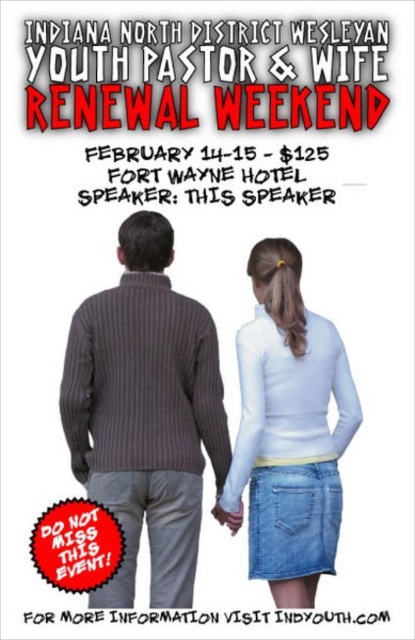
You are designing a layout for a promotional poster and need to place a new element. The existing black paper text at center is positioned at coordinates 0.278, 0.494. If you want to place a new element to the right of this text, where should you position it?

To place a new element to the right of the black paper text at center, position it at a coordinate with an x value greater than 0.278, such as 0.3 or higher, while maintaining the same y coordinate of 0.494.

Based on the scene description, which object is positioned higher up in the image between the white matte turtleneck at center and the black paper text at center?

The white matte turtleneck at center is positioned higher up in the image than the black paper text at center.